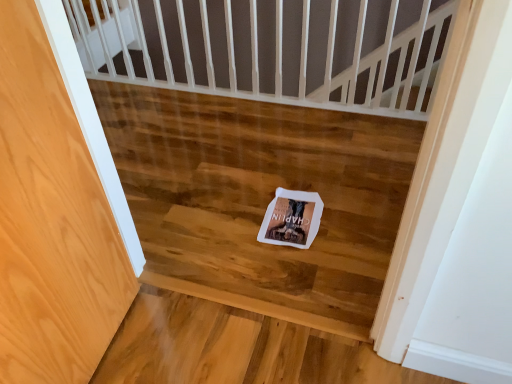
The width and height of the screenshot is (512, 384). I want to click on free space above white paper postcard at center (from a real-world perspective), so (x=291, y=211).